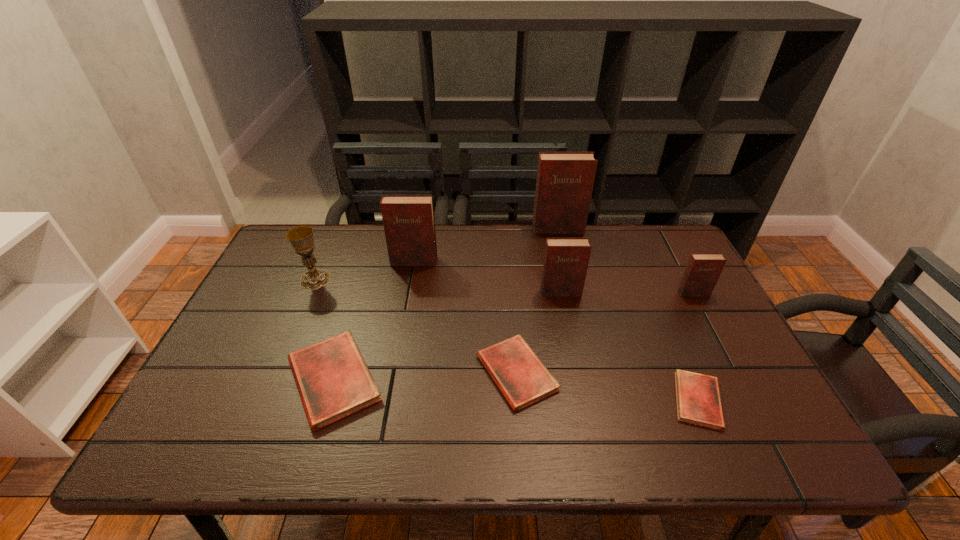
Find the location of `free space between the leftmost red diary and the farthest object`. free space between the leftmost red diary and the farthest object is located at coordinates (445, 304).

Where is `unoccupied area between the second biggest red diary and the tallest diary`? unoccupied area between the second biggest red diary and the tallest diary is located at coordinates (538, 301).

This screenshot has height=540, width=960. In order to click on vacant space in between the leftmost reddish-brown diary and the rightmost red diary in this screenshot , I will do `click(556, 331)`.

The image size is (960, 540). Identify the location of empty space between the sixth diary from left to right and the second biggest red diary. (608, 387).

Locate an element on the screen. Image resolution: width=960 pixels, height=540 pixels. unoccupied position between the second smallest reddish-brown diary and the rightmost diary is located at coordinates pos(627,293).

The image size is (960, 540). What are the coordinates of `empty space that is in between the seventh tallest object and the third biggest reddish-brown diary` in the screenshot? It's located at (539, 333).

At what (x,y) coordinates should I click in order to perform the action: click on vacant point located between the third smallest reddish-brown diary and the third biggest reddish-brown diary. Please return your answer as a coordinate pair (x, y). Looking at the image, I should click on (487, 277).

At what (x,y) coordinates should I click in order to perform the action: click on free spot between the second shortest object and the biggest red diary. Please return your answer as a coordinate pair (x, y). The width and height of the screenshot is (960, 540). Looking at the image, I should click on (425, 376).

I want to click on object that is the second closest to the rightmost object, so click(565, 265).

At what (x,y) coordinates should I click in order to perform the action: click on object identified as the second closest to the third biggest reddish-brown diary. Please return your answer as a coordinate pair (x, y). This screenshot has height=540, width=960. Looking at the image, I should click on (565, 180).